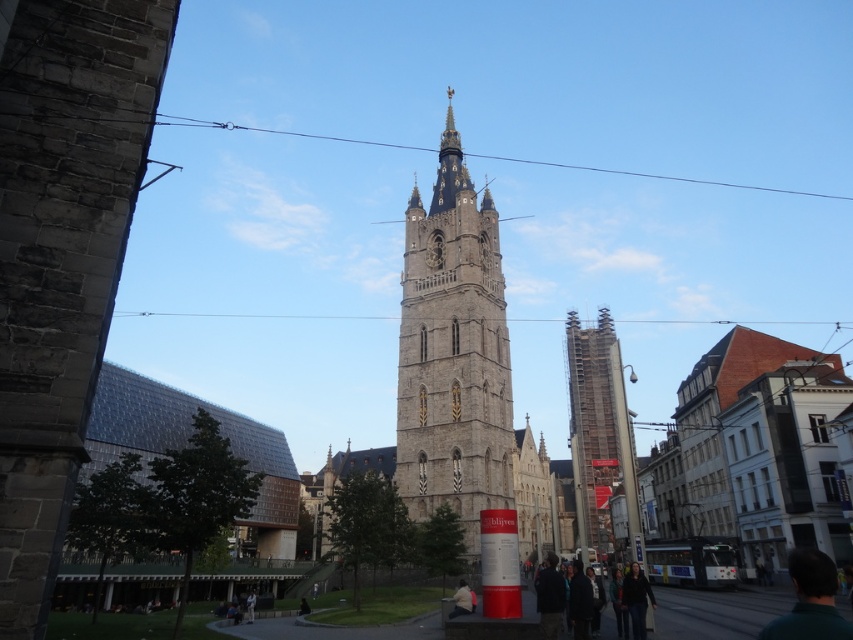
Question: Which of the following is the closest to the observer?

Choices:
 (A) (641, 588)
 (B) (477, 433)

Answer: (A)

Question: Is green matte shirt at lower right positioned at the back of light brown leather jacket at lower center?

Choices:
 (A) no
 (B) yes

Answer: (A)

Question: In this image, where is stone tower at center located relative to dark gray sweater at lower right?

Choices:
 (A) above
 (B) below

Answer: (A)

Question: Does stone tower at center appear over light brown leather jacket at lower center?

Choices:
 (A) yes
 (B) no

Answer: (A)

Question: Among these objects, which one is farthest from the camera?

Choices:
 (A) dark gray sweater at lower right
 (B) light brown leather jacket at lower center

Answer: (B)

Question: Which of the following is the farthest from the observer?

Choices:
 (A) green matte shirt at lower right
 (B) dark gray sweater at lower right

Answer: (B)